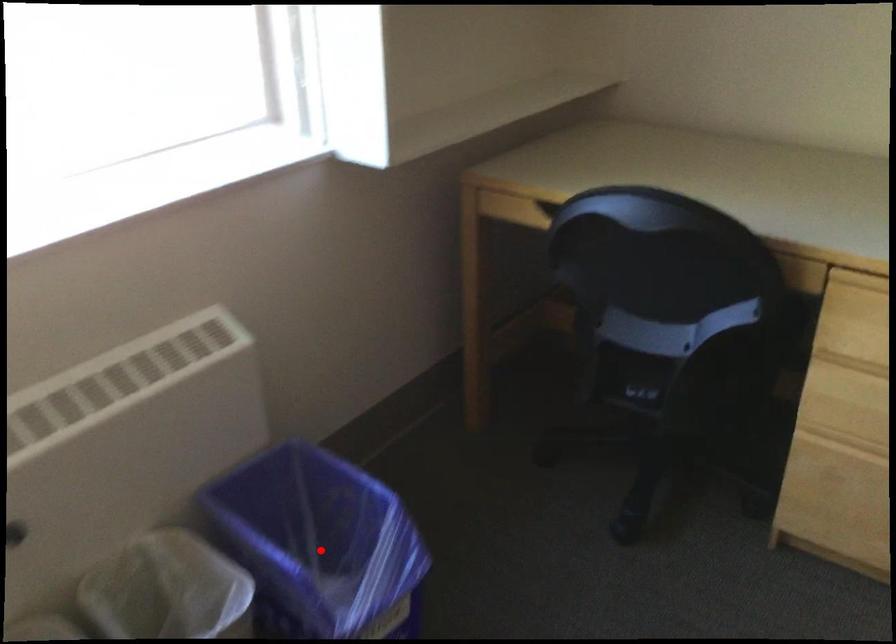
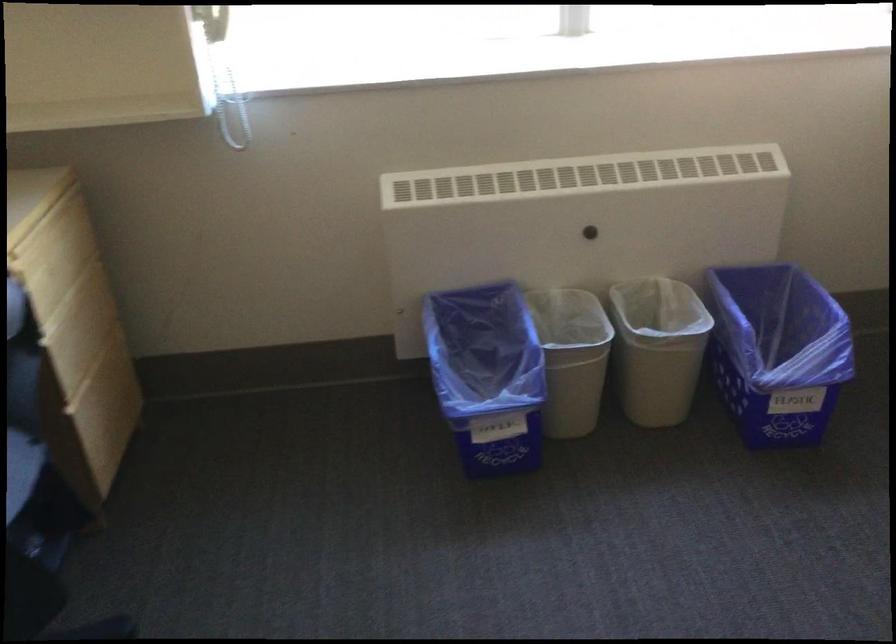
Question: I am providing you with two images of the same scene from different viewpoints. Given a red point in image1, look at the same physical point in image2. Is it:

Choices:
 (A) Closer to the viewpoint
 (B) Farther from the viewpoint

Answer: (B)